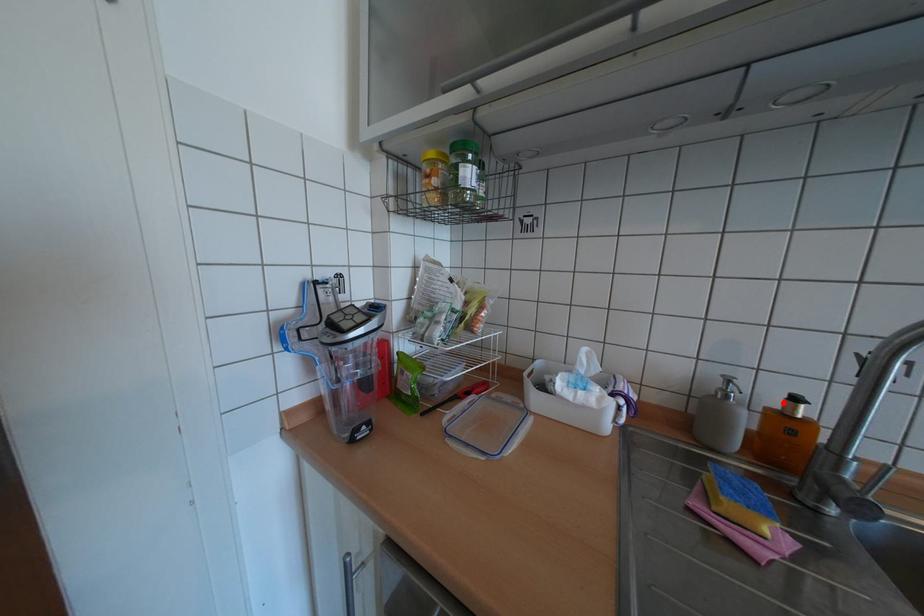
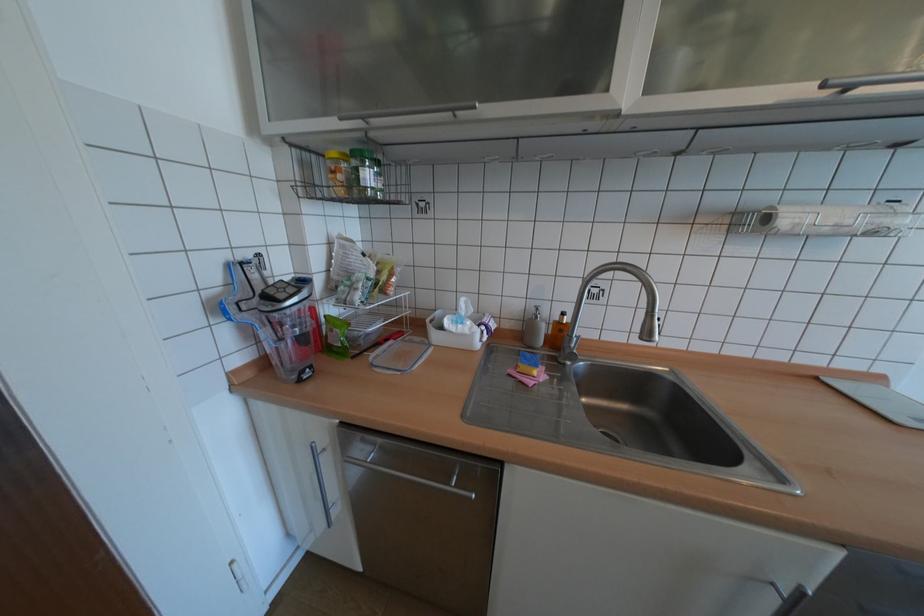
Locate, in the second image, the point that corresponds to the highlighted location in the first image.

(565, 317)